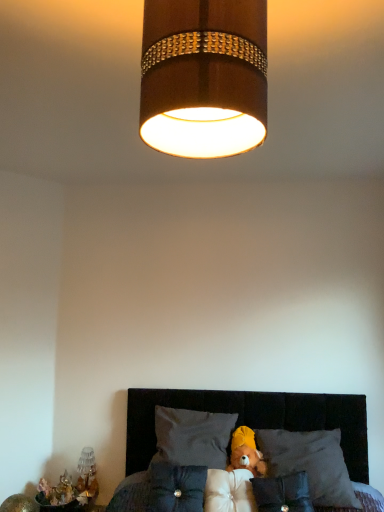
At what (x,y) coordinates should I click in order to perform the action: click on velvety gray pillow at center, placed as the 1th pillow when sorted from left to right. Please return your answer as a coordinate pair (x, y). The width and height of the screenshot is (384, 512). Looking at the image, I should click on (176, 487).

Image resolution: width=384 pixels, height=512 pixels. In order to click on velvet dark gray pillow at lower center, the 4th pillow positioned from the left in this screenshot , I will do `click(283, 493)`.

From the picture: What is the approximate height of white soft pillow at center, arranged as the 3th pillow when viewed from the right?

white soft pillow at center, arranged as the 3th pillow when viewed from the right, is 11.73 inches tall.

I want to click on white soft pillow at center, arranged as the 3th pillow when viewed from the right, so click(x=229, y=490).

At what (x,y) coordinates should I click in order to perform the action: click on translucent glass vase at lower left. Please return your answer as a coordinate pair (x, y). Looking at the image, I should click on (87, 475).

Is point (232, 448) in front of point (173, 435)?

No, (232, 448) is behind (173, 435).

Considering the sizes of objects fluffy brown teddy bear at center and gray fabric pillow at center, the second pillow in the left-to-right sequence, in the image provided, who is shorter, fluffy brown teddy bear at center or gray fabric pillow at center, the second pillow in the left-to-right sequence,?

fluffy brown teddy bear at center.

Which is in front, fluffy brown teddy bear at center or gray fabric pillow at center, the fourth pillow positioned from the right?

gray fabric pillow at center, the fourth pillow positioned from the right.

Are fluffy brown teddy bear at center and gray fabric pillow at center, the fourth pillow positioned from the right, far apart?

No, fluffy brown teddy bear at center is not far from gray fabric pillow at center, the fourth pillow positioned from the right.

Which of these two, white soft pillow at center, arranged as the 3th pillow when viewed from the right, or gray fabric pillow at center, the fourth pillow positioned from the right, is smaller?

With smaller size is white soft pillow at center, arranged as the 3th pillow when viewed from the right.

Looking at this image, does white soft pillow at center, arranged as the 3th pillow when viewed from the right, touch gray fabric pillow at center, the second pillow in the left-to-right sequence?

white soft pillow at center, arranged as the 3th pillow when viewed from the right, is not next to gray fabric pillow at center, the second pillow in the left-to-right sequence, and they're not touching.

Is gray fabric pillow at center, the fourth pillow positioned from the right, at the back of white soft pillow at center, arranged as the 3th pillow when viewed from the right?

white soft pillow at center, arranged as the 3th pillow when viewed from the right, does not have its back to gray fabric pillow at center, the fourth pillow positioned from the right.

Is point (219, 510) closer or farther from the camera than point (198, 460)?

Point (219, 510) is closer to the camera than point (198, 460).

Between dark gray fabric pillow at center, the fifth pillow positioned from the left, and fluffy brown teddy bear at center, which one has more height?

With more height is dark gray fabric pillow at center, the fifth pillow positioned from the left.

Is dark gray fabric pillow at center, arranged as the first pillow when viewed from the right, bigger than fluffy brown teddy bear at center?

Yes, dark gray fabric pillow at center, arranged as the first pillow when viewed from the right, is bigger than fluffy brown teddy bear at center.

This screenshot has height=512, width=384. I want to click on pillow that is the 2nd object located in front of the fluffy brown teddy bear at center, so click(310, 463).

How different are the orientations of dark gray fabric pillow at center, the fifth pillow positioned from the left, and fluffy brown teddy bear at center in degrees?

dark gray fabric pillow at center, the fifth pillow positioned from the left, and fluffy brown teddy bear at center are facing 4.19 degrees away from each other.

From a real-world perspective, which object rests below the other?

gray fabric pillow at center, the second pillow in the left-to-right sequence.

Is wooden lampshade at upper center a part of gray fabric pillow at center, the second pillow in the left-to-right sequence?

No, wooden lampshade at upper center is not surrounded by gray fabric pillow at center, the second pillow in the left-to-right sequence.

In terms of height, does gray fabric pillow at center, the second pillow in the left-to-right sequence, look taller or shorter compared to wooden lampshade at upper center?

gray fabric pillow at center, the second pillow in the left-to-right sequence, is shorter than wooden lampshade at upper center.

Who is shorter, velvety gray pillow at center, placed as the 1th pillow when sorted from left to right, or fluffy brown teddy bear at center?

fluffy brown teddy bear at center.

From a real-world perspective, relative to fluffy brown teddy bear at center, is velvety gray pillow at center, placed as the 1th pillow when sorted from left to right, vertically above or below?

In terms of real-world spatial position, velvety gray pillow at center, placed as the 1th pillow when sorted from left to right, is below fluffy brown teddy bear at center.

Is velvety gray pillow at center, placed as the 1th pillow when sorted from left to right, in front of or behind fluffy brown teddy bear at center in the image?

velvety gray pillow at center, placed as the 1th pillow when sorted from left to right, is in front of fluffy brown teddy bear at center.

Find the location of a particular element. teddy lying above the velvety gray pillow at center, the 5th pillow viewed from the right (from the image's perspective) is located at coordinates (246, 452).

Is there a large distance between wooden lampshade at upper center and gray fabric pillow at center, the fourth pillow positioned from the right?

That's right, there is a large distance between wooden lampshade at upper center and gray fabric pillow at center, the fourth pillow positioned from the right.

From a real-world perspective, between wooden lampshade at upper center and gray fabric pillow at center, the fourth pillow positioned from the right, who is vertically higher?

wooden lampshade at upper center.

Considering the sizes of wooden lampshade at upper center and gray fabric pillow at center, the second pillow in the left-to-right sequence, in the image, is wooden lampshade at upper center taller or shorter than gray fabric pillow at center, the second pillow in the left-to-right sequence,?

In the image, wooden lampshade at upper center appears to be taller than gray fabric pillow at center, the second pillow in the left-to-right sequence.

What's the angular difference between dark gray fabric pillow at center, arranged as the first pillow when viewed from the right, and gray fabric pillow at center, the fourth pillow positioned from the right,'s facing directions?

The facing directions of dark gray fabric pillow at center, arranged as the first pillow when viewed from the right, and gray fabric pillow at center, the fourth pillow positioned from the right, are 0.0241 degrees apart.

Is dark gray fabric pillow at center, arranged as the first pillow when viewed from the right, facing away from gray fabric pillow at center, the second pillow in the left-to-right sequence?

That's not correct — dark gray fabric pillow at center, arranged as the first pillow when viewed from the right, is not looking away from gray fabric pillow at center, the second pillow in the left-to-right sequence.

Can you confirm if dark gray fabric pillow at center, the fifth pillow positioned from the left, is bigger than gray fabric pillow at center, the second pillow in the left-to-right sequence?

Yes.

Is dark gray fabric pillow at center, the fifth pillow positioned from the left, wider or thinner than gray fabric pillow at center, the fourth pillow positioned from the right?

dark gray fabric pillow at center, the fifth pillow positioned from the left, is wider than gray fabric pillow at center, the fourth pillow positioned from the right.

There is a fluffy brown teddy bear at center. At what (x,y) coordinates should I click in order to perform the action: click on pillow above it (from a real-world perspective). Please return your answer as a coordinate pair (x, y). This screenshot has height=512, width=384. Looking at the image, I should click on (193, 437).

Starting from the white soft pillow at center, positioned as the third pillow in left-to-right order, which pillow is the 2nd one behind? Please provide its 2D coordinates.

[(193, 437)]

Based on their spatial positions, is velvety gray pillow at center, the 5th pillow viewed from the right, or wooden lampshade at upper center closer to dark gray fabric pillow at center, the fifth pillow positioned from the left?

The object closer to dark gray fabric pillow at center, the fifth pillow positioned from the left, is velvety gray pillow at center, the 5th pillow viewed from the right.

From the image, which object appears to be nearer to white soft pillow at center, positioned as the third pillow in left-to-right order, velvet dark gray pillow at lower center, which appears as the second pillow when viewed from the right, or gray fabric pillow at center, the second pillow in the left-to-right sequence?

Among the two, velvet dark gray pillow at lower center, which appears as the second pillow when viewed from the right, is located nearer to white soft pillow at center, positioned as the third pillow in left-to-right order.

Estimate the real-world distances between objects in this image. Which object is closer to white soft pillow at center, positioned as the third pillow in left-to-right order, fluffy brown teddy bear at center or velvet dark gray bed at center?

The object closer to white soft pillow at center, positioned as the third pillow in left-to-right order, is fluffy brown teddy bear at center.

When comparing their distances from velvet dark gray bed at center, does fluffy brown teddy bear at center or dark gray fabric pillow at center, the fifth pillow positioned from the left, seem further?

fluffy brown teddy bear at center lies further to velvet dark gray bed at center than the other object.

When comparing their distances from fluffy brown teddy bear at center, does white soft pillow at center, positioned as the third pillow in left-to-right order, or wooden lampshade at upper center seem further?

wooden lampshade at upper center.

From the picture: Based on their spatial positions, is gray fabric pillow at center, the fourth pillow positioned from the right, or dark gray fabric pillow at center, the fifth pillow positioned from the left, further from wooden lampshade at upper center?

dark gray fabric pillow at center, the fifth pillow positioned from the left.

From the image, which object appears to be farther from velvet dark gray pillow at lower center, the 4th pillow positioned from the left, velvety gray pillow at center, placed as the 1th pillow when sorted from left to right, or dark gray fabric pillow at center, the fifth pillow positioned from the left?

velvety gray pillow at center, placed as the 1th pillow when sorted from left to right, lies further to velvet dark gray pillow at lower center, the 4th pillow positioned from the left, than the other object.

When comparing their distances from wooden lampshade at upper center, does dark gray fabric pillow at center, the fifth pillow positioned from the left, or gray fabric pillow at center, the second pillow in the left-to-right sequence, seem further?

dark gray fabric pillow at center, the fifth pillow positioned from the left.

Locate an element on the screen. The image size is (384, 512). pillow between velvet dark gray bed at center and velvety gray pillow at center, placed as the 1th pillow when sorted from left to right, from front to back is located at coordinates (283, 493).

You are a GUI agent. You are given a task and a screenshot of the screen. Output one action in this format:
    pyautogui.click(x=<x>, y=<y>)
    Task: Click on the teddy situated between gray fabric pillow at center, the fourth pillow positioned from the right, and velvet dark gray pillow at lower center, which appears as the second pillow when viewed from the right, from left to right
    The width and height of the screenshot is (384, 512).
    Given the screenshot: What is the action you would take?
    pyautogui.click(x=246, y=452)

Locate an element on the screen. Image resolution: width=384 pixels, height=512 pixels. pillow between white soft pillow at center, arranged as the 3th pillow when viewed from the right, and dark gray fabric pillow at center, arranged as the first pillow when viewed from the right, in the horizontal direction is located at coordinates (283, 493).

Where is `furniture between wooden lampshade at upper center and velvety gray pillow at center, the 5th pillow viewed from the right, in the vertical direction`? The width and height of the screenshot is (384, 512). furniture between wooden lampshade at upper center and velvety gray pillow at center, the 5th pillow viewed from the right, in the vertical direction is located at coordinates (253, 419).